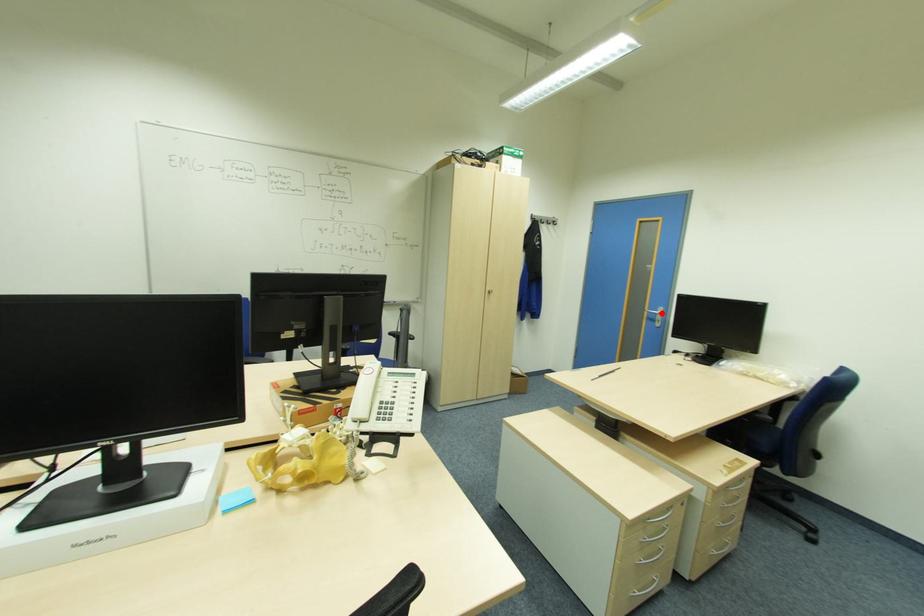
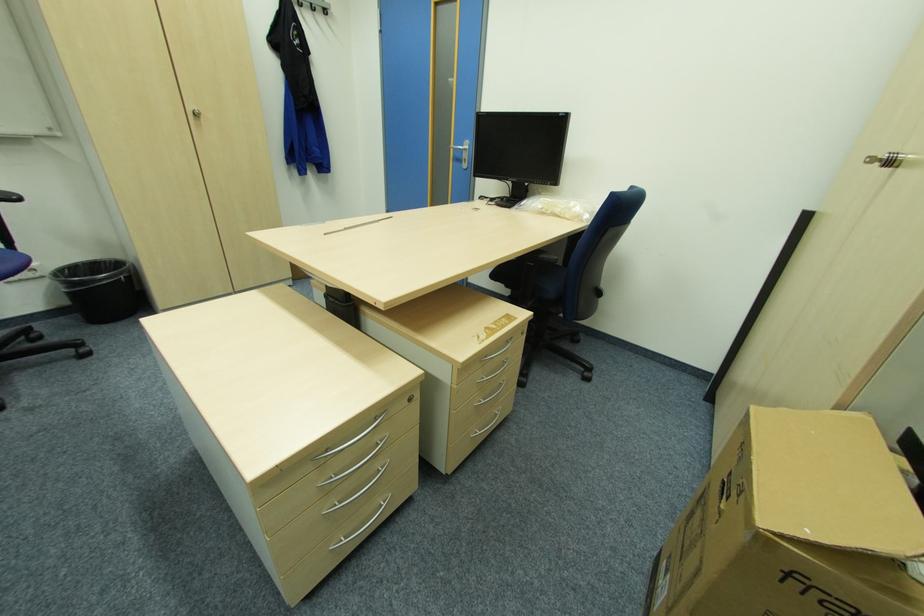
Question: I am providing you with two images of the same scene from different viewpoints. Given a red point in image1, look at the same physical point in image2. Is it:

Choices:
 (A) Closer to the viewpoint
 (B) Farther from the viewpoint

Answer: (A)